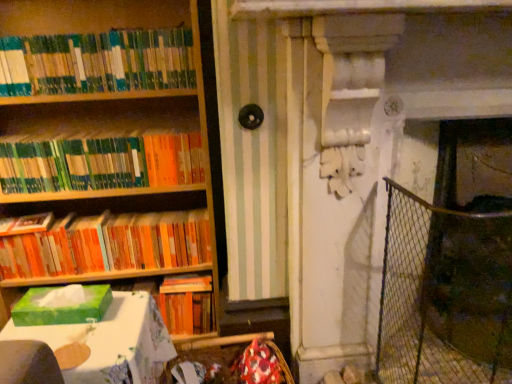
At what (x,y) coordinates should I click in order to perform the action: click on vacant space in front of green matte tissue box at left. Please return your answer as a coordinate pair (x, y). The image size is (512, 384). Looking at the image, I should click on coord(69,342).